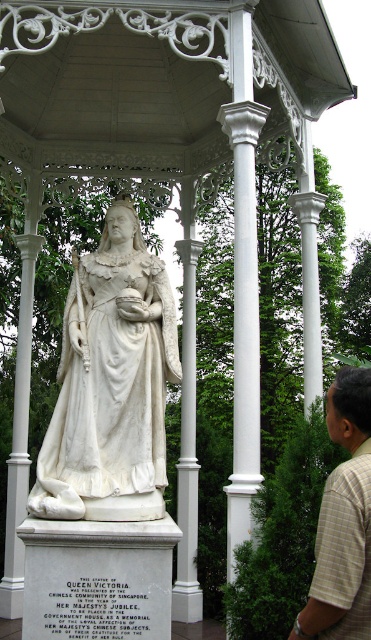
You are a photographer setting up a tripod to capture the statue of Queen Victoria. You notice the white marble column at center and the light brown plaid shirt at lower right in your frame. Which object is taller in the image?

The white marble column at center is taller than the light brown plaid shirt at lower right according to the description.

You are a tour guide explaining the statue of Queen Victoria to a group. You notice a person wearing a light brown plaid shirt at lower right in the background. Where is this person located relative to the white marble statue at center?

The light brown plaid shirt at lower right is behind the white marble statue at center.

You are standing in front of the statue of Queen Victoria and notice two points marked on the ground. The first point is at coordinate point (x=113, y=518) and the second is at point (x=346, y=620). Which point is closer to you?

Point (x=346, y=620) is closer to you because it is in front of point (x=113, y=518).